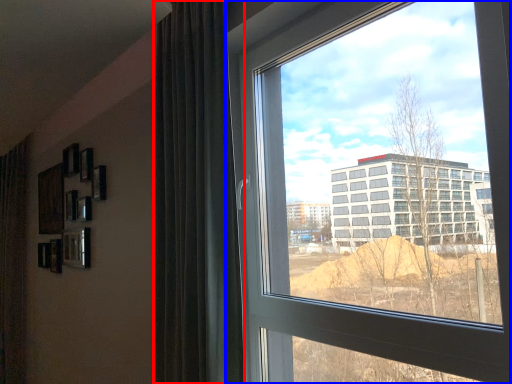
Question: Which object appears farthest to the camera in this image, curtain (highlighted by a red box) or window (highlighted by a blue box)?

Choices:
 (A) curtain
 (B) window

Answer: (A)